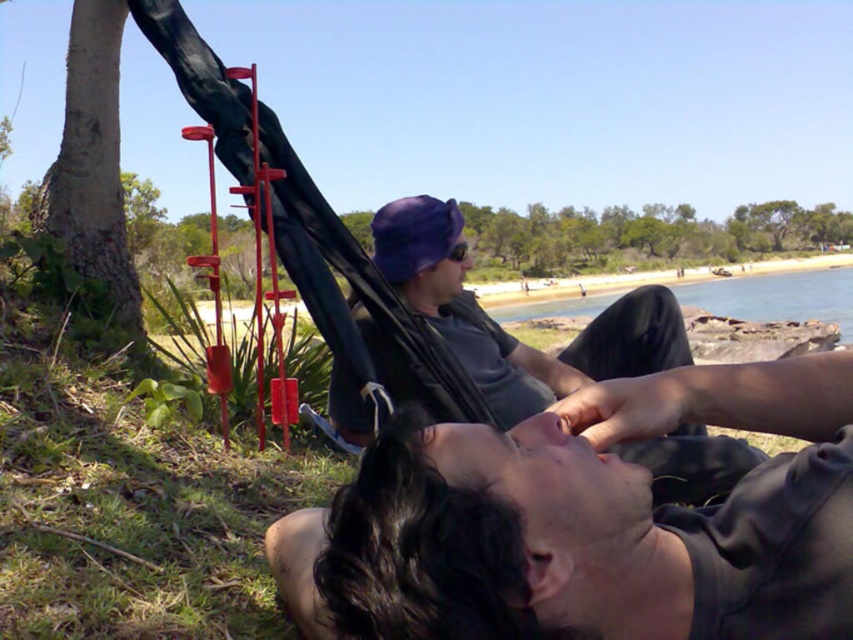
You are standing at the origin point in this scene. You want to walk directly to the matte gray shirt at center. What direction should you go in? Assume the scene is a coordinate plane with the origin at the bottom left corner.

Since the matte gray shirt at center has coordinates at point (503, 330), you should move northeast to reach it.

You are standing at the beach and want to take a photo of the smooth brown tree trunk at left and the clear blue water at beach right. Which object should you focus on first if you want both to be in focus?

The smooth brown tree trunk at left is closer to the viewer than the clear blue water at beach right. To have both in focus, you should focus on the smooth brown tree trunk at left because it is closer, ensuring the clear blue water at beach right will also be in focus if focused properly.